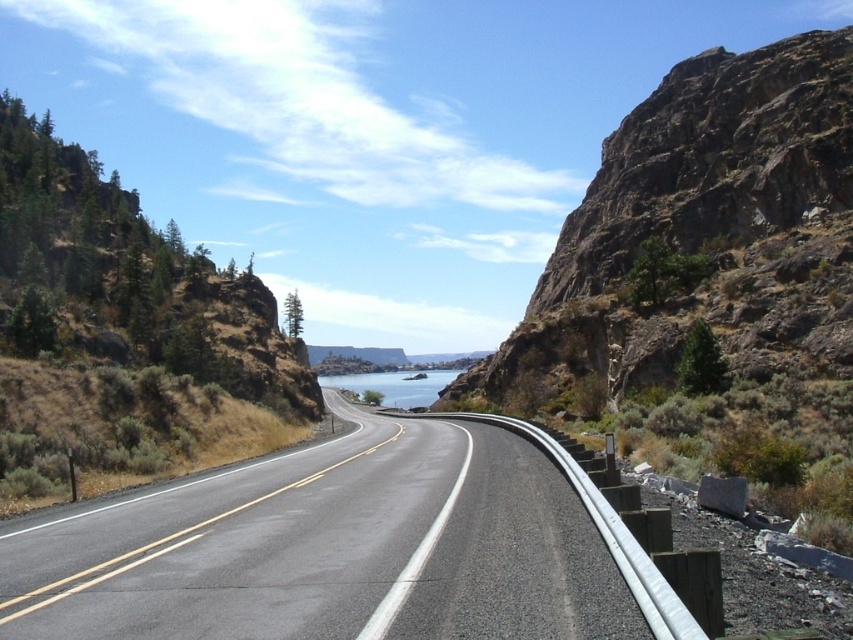
Does green textured rock at left have a smaller size compared to clear blue water at center?

Incorrect, green textured rock at left is not smaller in size than clear blue water at center.

Is point (68, 352) positioned in front of point (395, 403)?

Yes, point (68, 352) is in front of point (395, 403).

Is point (154, 268) farther from viewer compared to point (378, 372)?

No, it is not.

Image resolution: width=853 pixels, height=640 pixels. Find the location of `green textured rock at left`. green textured rock at left is located at coordinates (123, 336).

Is black asphalt highway at center below clear blue water at center?

Actually, black asphalt highway at center is above clear blue water at center.

Who is more distant from viewer, [250,621] or [381,390]?

The point [381,390] is more distant.

This screenshot has height=640, width=853. I want to click on black asphalt highway at center, so click(x=343, y=548).

Find the location of `black asphalt highway at center`. black asphalt highway at center is located at coordinates (343, 548).

Does black asphalt highway at center appear on the right side of green textured rock at left?

Yes, black asphalt highway at center is to the right of green textured rock at left.

Who is positioned more to the right, black asphalt highway at center or green textured rock at left?

Positioned to the right is black asphalt highway at center.

You are a GUI agent. You are given a task and a screenshot of the screen. Output one action in this format:
    pyautogui.click(x=<x>, y=<y>)
    Task: Click on the black asphalt highway at center
    The width and height of the screenshot is (853, 640).
    Given the screenshot: What is the action you would take?
    pyautogui.click(x=343, y=548)

Locate an element on the screen. This screenshot has width=853, height=640. black asphalt highway at center is located at coordinates (343, 548).